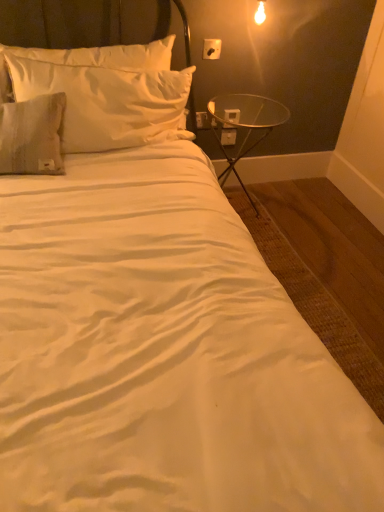
Question: Can you confirm if satin white pillow at upper left is shorter than white plastic electric outlet at upper right, arranged as the 1th electric outlet when viewed from the back?

Choices:
 (A) no
 (B) yes

Answer: (A)

Question: Is satin white pillow at upper left beside white plastic electric outlet at upper right, arranged as the third electric outlet when viewed from the top?

Choices:
 (A) yes
 (B) no

Answer: (B)

Question: Does satin white pillow at upper left have a larger size compared to white plastic electric outlet at upper right, arranged as the 1th electric outlet when viewed from the back?

Choices:
 (A) yes
 (B) no

Answer: (A)

Question: Is white plastic electric outlet at upper right, marked as the first electric outlet in a bottom-to-top arrangement, at the back of satin white pillow at upper left?

Choices:
 (A) yes
 (B) no

Answer: (B)

Question: From the image's perspective, is satin white pillow at upper left under white plastic electric outlet at upper right, arranged as the third electric outlet when viewed from the top?

Choices:
 (A) yes
 (B) no

Answer: (B)

Question: Is satin white pillow at upper left not inside white plastic electric outlet at upper right, arranged as the third electric outlet when viewed from the top?

Choices:
 (A) yes
 (B) no

Answer: (A)

Question: Considering the relative sizes of white plastic electric outlet at upper right, marked as the first electric outlet in a bottom-to-top arrangement, and white plastic electric outlet at upper right, the second electric outlet in the bottom-to-top sequence, in the image provided, is white plastic electric outlet at upper right, marked as the first electric outlet in a bottom-to-top arrangement, smaller than white plastic electric outlet at upper right, the second electric outlet in the bottom-to-top sequence,?

Choices:
 (A) no
 (B) yes

Answer: (B)

Question: From the image's perspective, does white plastic electric outlet at upper right, arranged as the third electric outlet when viewed from the top, appear higher than white plastic electric outlet at upper right, the 2th electric outlet from the top?

Choices:
 (A) yes
 (B) no

Answer: (B)

Question: Is white plastic electric outlet at upper right, arranged as the 1th electric outlet when viewed from the back, turned away from white plastic electric outlet at upper right, the second electric outlet in the bottom-to-top sequence?

Choices:
 (A) no
 (B) yes

Answer: (A)

Question: Considering the relative sizes of white plastic electric outlet at upper right, arranged as the third electric outlet when viewed from the top, and white plastic electric outlet at upper right, which is the second electric outlet from front to back, in the image provided, is white plastic electric outlet at upper right, arranged as the third electric outlet when viewed from the top, taller than white plastic electric outlet at upper right, which is the second electric outlet from front to back,?

Choices:
 (A) no
 (B) yes

Answer: (A)

Question: Is white plastic electric outlet at upper right, marked as the first electric outlet in a bottom-to-top arrangement, completely or partially outside of white plastic electric outlet at upper right, the second electric outlet from the back?

Choices:
 (A) no
 (B) yes

Answer: (B)

Question: Considering the relative sizes of white plastic electric outlet at upper right, marked as the first electric outlet in a bottom-to-top arrangement, and white plastic electric outlet at upper right, the second electric outlet in the bottom-to-top sequence, in the image provided, is white plastic electric outlet at upper right, marked as the first electric outlet in a bottom-to-top arrangement, wider than white plastic electric outlet at upper right, the second electric outlet in the bottom-to-top sequence,?

Choices:
 (A) yes
 (B) no

Answer: (B)

Question: Would you say transparent glass table at right is a long distance from white plastic electric outlet at upper right, the 2th electric outlet from the top?

Choices:
 (A) yes
 (B) no

Answer: (B)